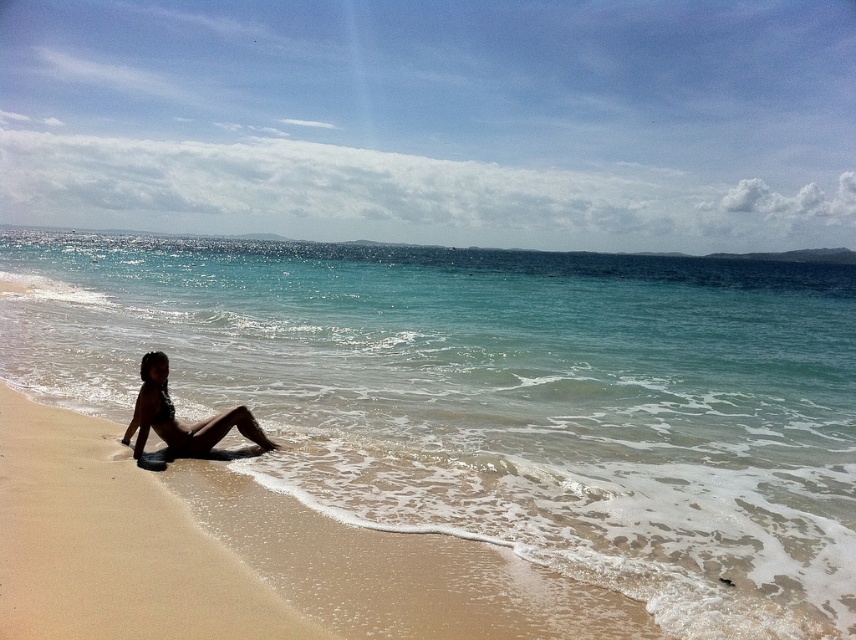
Question: In this image, where is clear blue water at center located relative to matte black bikini at lower left?

Choices:
 (A) right
 (B) left

Answer: (A)

Question: Based on their relative distances, which object is nearer to the clear blue water at center?

Choices:
 (A) matte black bikini at lower left
 (B) beige sand at lower left

Answer: (A)

Question: Which is farther from the matte black bikini at lower left?

Choices:
 (A) clear blue water at center
 (B) beige sand at lower left

Answer: (A)

Question: Which of these objects is positioned farthest from the matte black bikini at lower left?

Choices:
 (A) beige sand at lower left
 (B) clear blue water at center

Answer: (B)

Question: Does clear blue water at center appear on the left side of matte black bikini at lower left?

Choices:
 (A) yes
 (B) no

Answer: (B)

Question: Is beige sand at lower left smaller than matte black bikini at lower left?

Choices:
 (A) yes
 (B) no

Answer: (A)